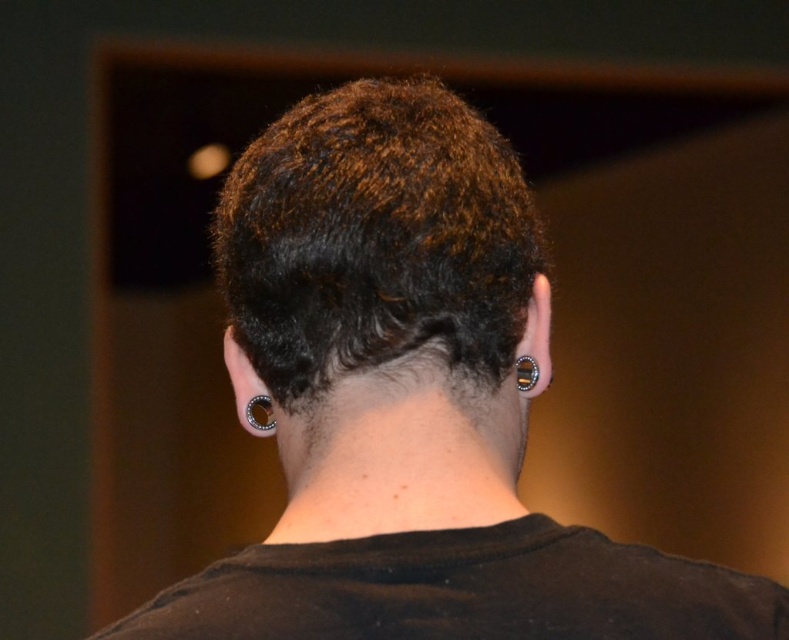
Question: Is black cotton t-shirt at center wider than satin silver ring at ear?

Choices:
 (A) yes
 (B) no

Answer: (A)

Question: Considering the real-world distances, which object is closest to the black metallic ring at ear?

Choices:
 (A) dark brown curly hair at center
 (B) satin silver ring at ear
 (C) black cotton t-shirt at center

Answer: (A)

Question: Estimate the real-world distances between objects in this image. Which object is farther from the black metallic ring at ear?

Choices:
 (A) dark brown curly hair at center
 (B) satin silver ring at ear

Answer: (B)

Question: Does dark brown curly hair at center appear on the left side of black cotton t-shirt at center?

Choices:
 (A) yes
 (B) no

Answer: (A)

Question: Which point is farther from the camera taking this photo?

Choices:
 (A) (249, 412)
 (B) (225, 202)
 (C) (526, 368)

Answer: (A)

Question: Is dark brown curly hair at center to the left of black metallic ring at ear from the viewer's perspective?

Choices:
 (A) yes
 (B) no

Answer: (A)